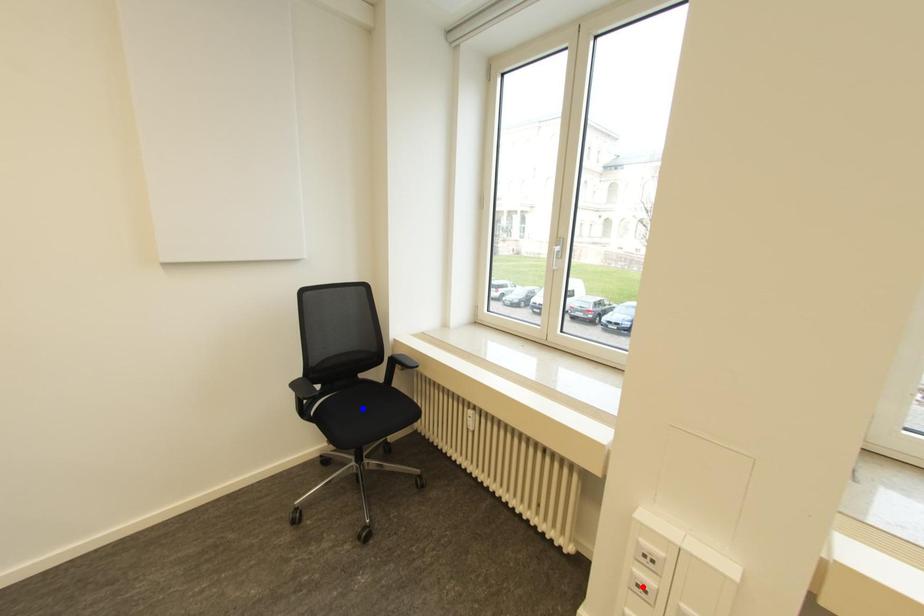
Question: In the image, two points are highlighted. Which point is nearer to the camera? Reply with the corresponding letter.

Choices:
 (A) blue point
 (B) red point

Answer: (B)